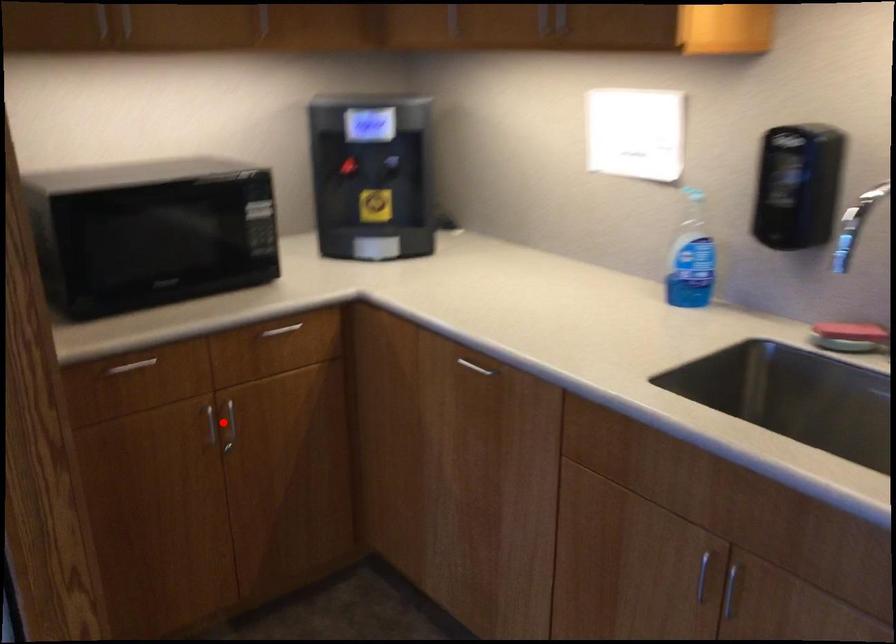
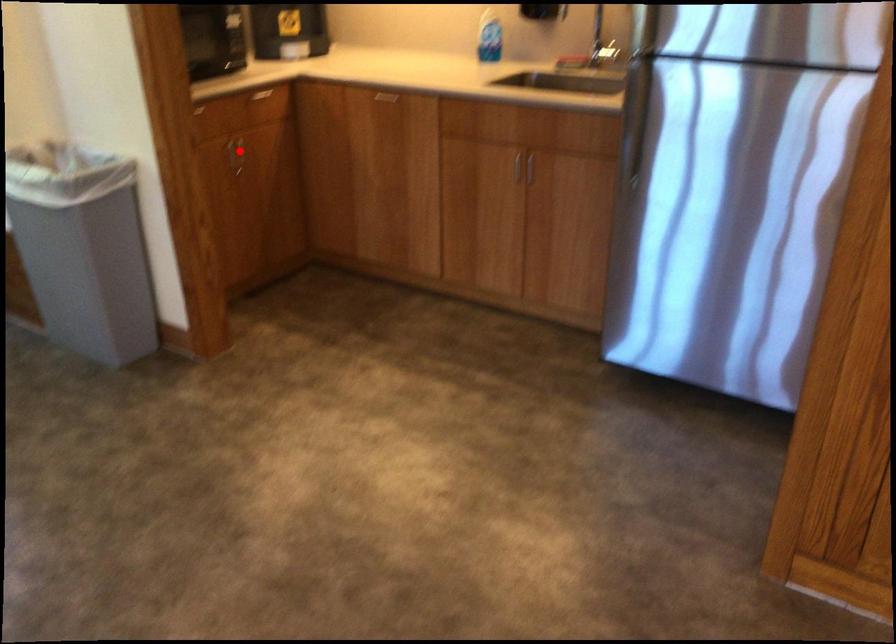
I am providing you with two images of the same scene from different viewpoints. A red point is marked on the first image and another point is marked on the second image. Is the marked point in image1 the same physical position as the marked point in image2?

No